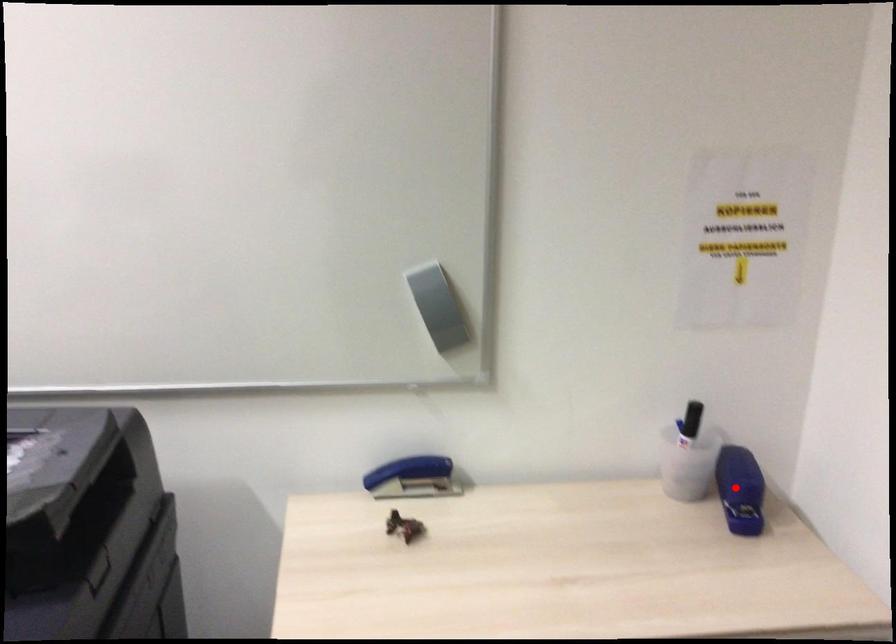
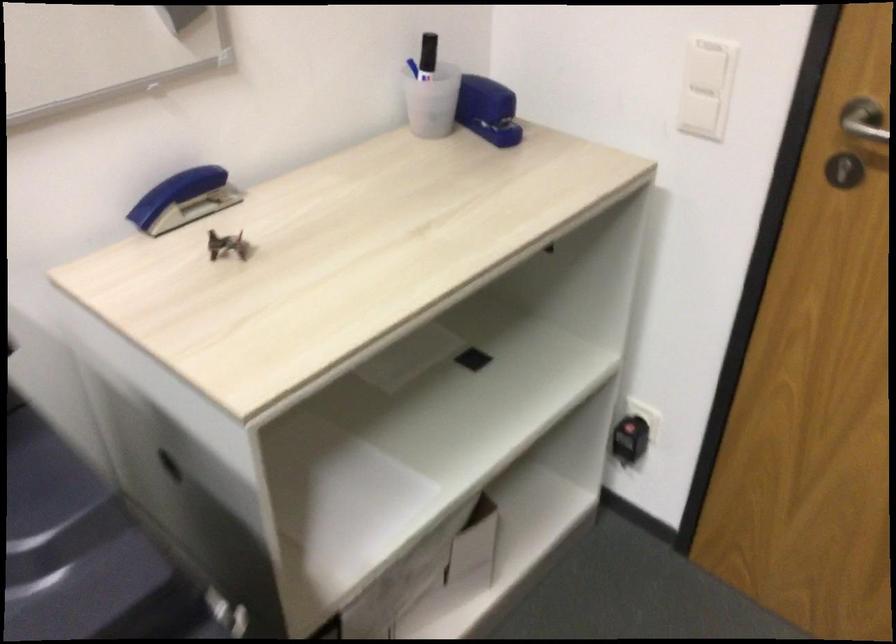
Where in the second image is the point corresponding to the highlighted location from the first image?

(487, 109)